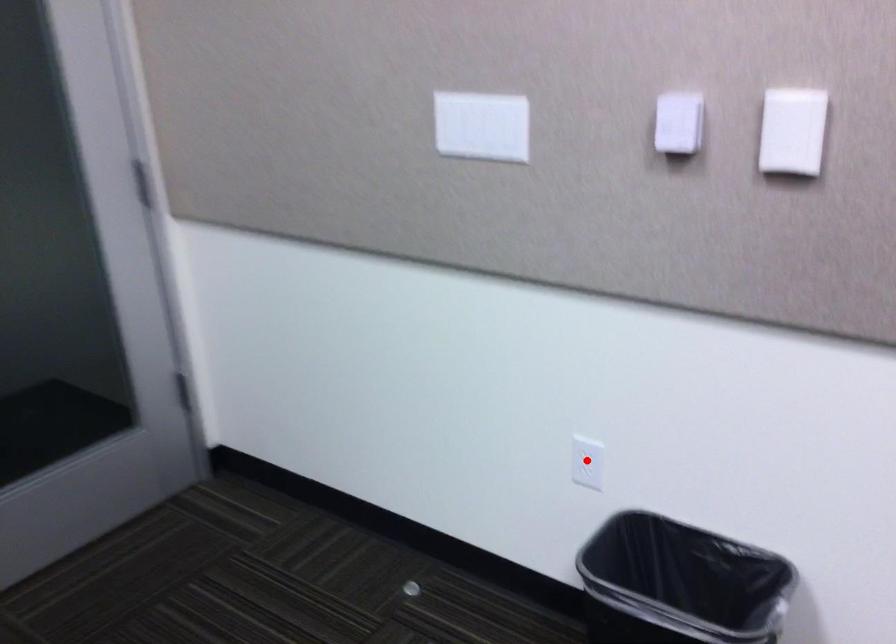
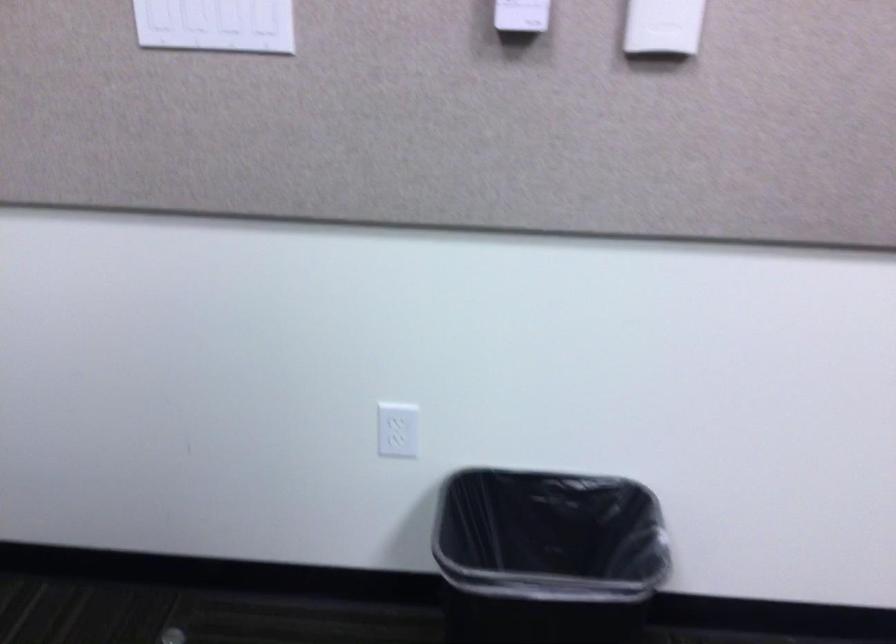
Question: I am providing you with two images of the same scene from different viewpoints. A red point is marked on the first image. Can you still see the location of the red point in image 2?

Choices:
 (A) Yes
 (B) No

Answer: (A)